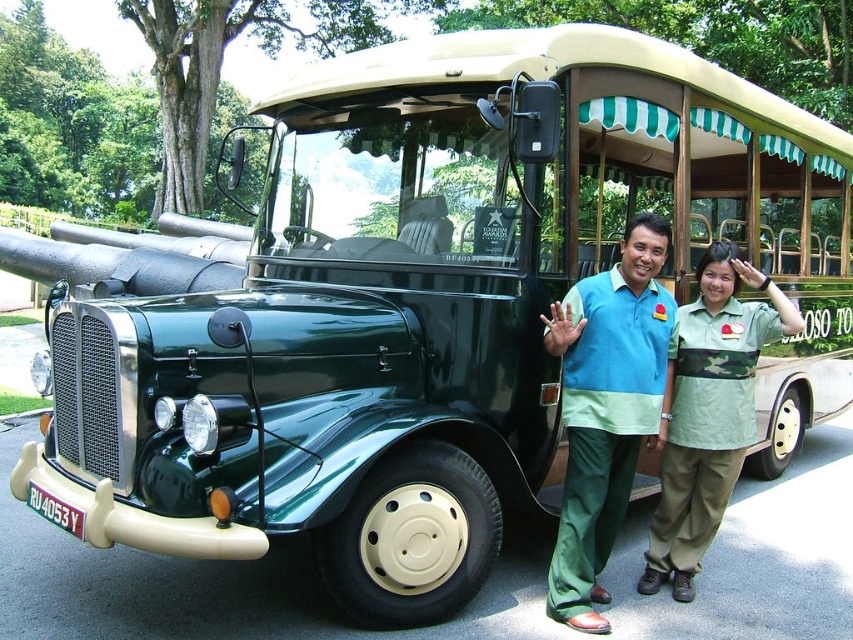
Can you confirm if blue-green fabric shirt at center is positioned above camouflage fabric shirt at center?

Correct, blue-green fabric shirt at center is located above camouflage fabric shirt at center.

Does blue-green fabric shirt at center lie behind camouflage fabric shirt at center?

No, it is in front of camouflage fabric shirt at center.

This screenshot has height=640, width=853. I want to click on blue-green fabric shirt at center, so click(x=607, y=408).

This screenshot has width=853, height=640. I want to click on blue-green fabric shirt at center, so click(607, 408).